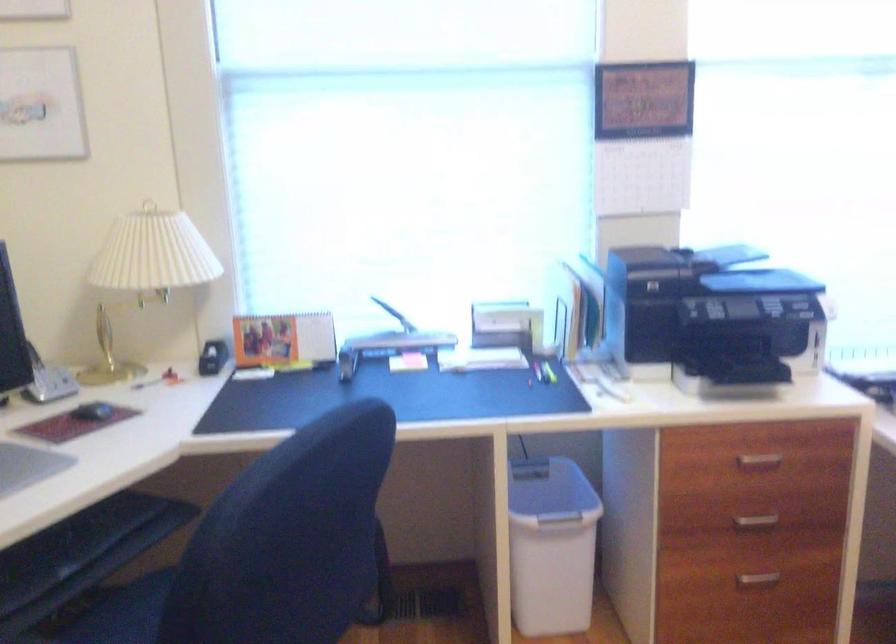
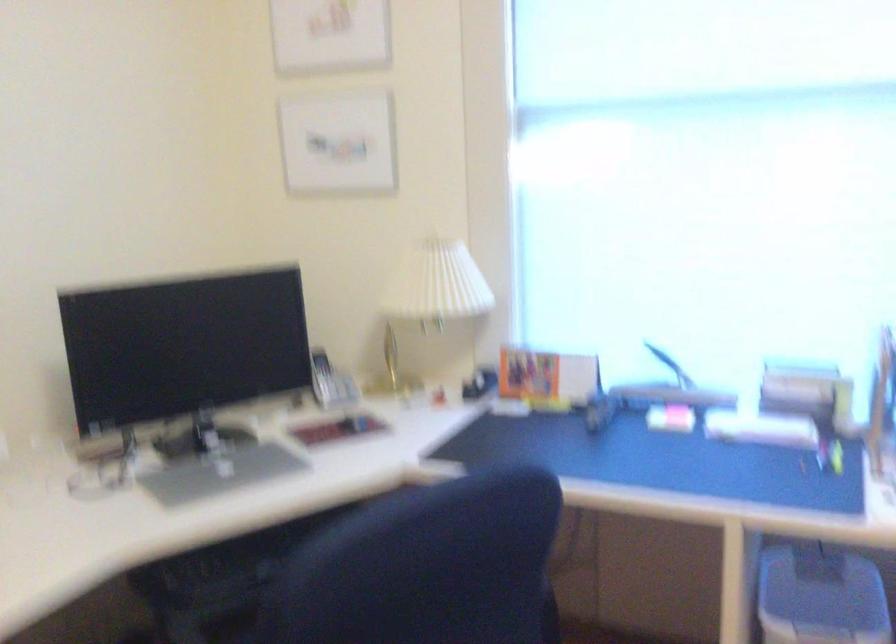
In the second image, find the point that corresponds to [531,489] in the first image.

(821, 596)